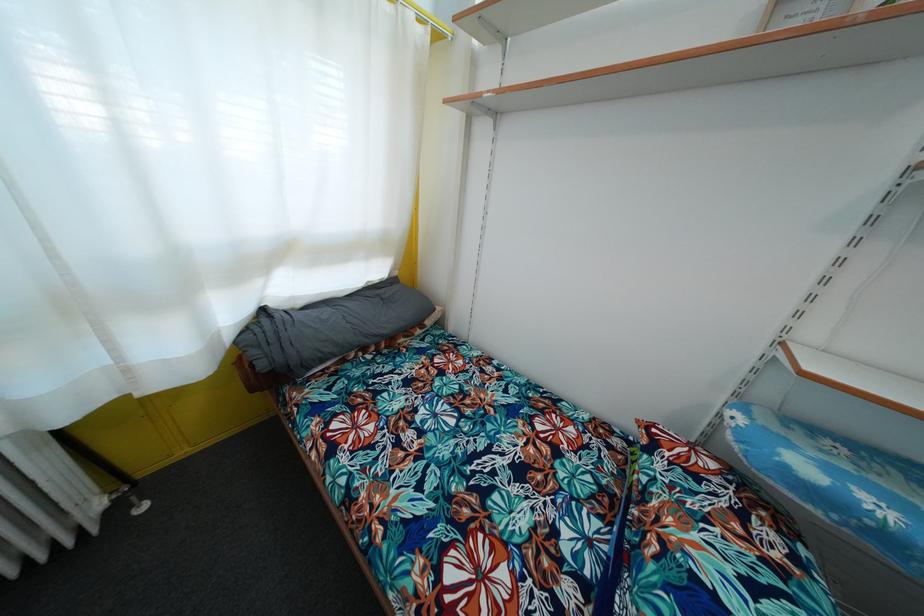
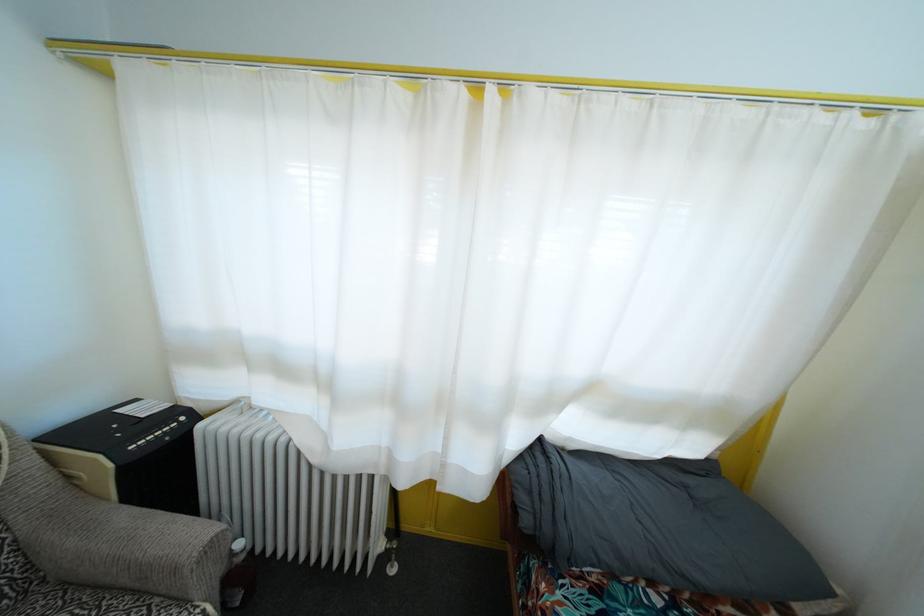
Question: The camera is either moving clockwise (left) or counter-clockwise (right) around the object. The first image is from the beginning of the video and the second image is from the end. Is the camera moving left or right when shooting the video?

Choices:
 (A) Left
 (B) Right

Answer: (B)